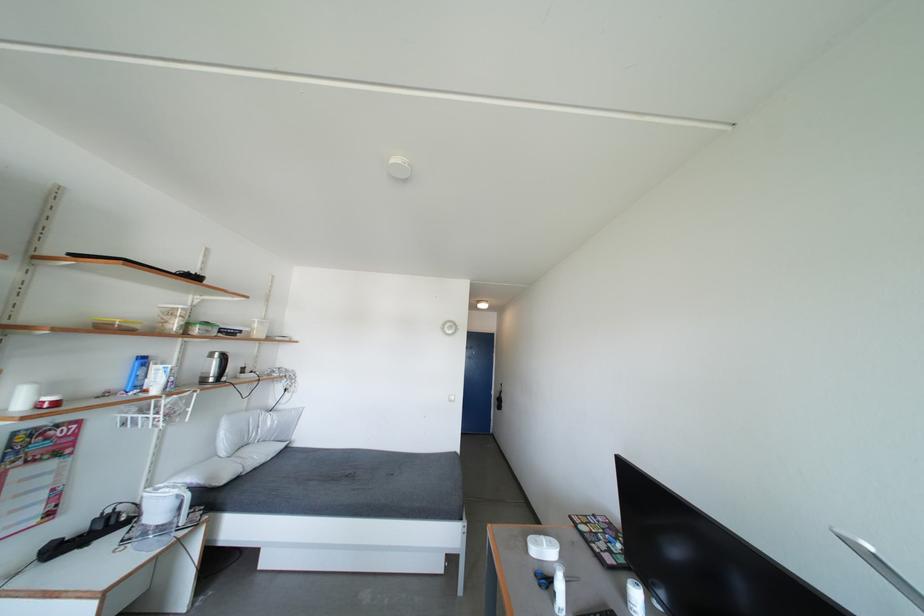
Find where to lift the black stickered case. Please return your answer as a coordinate pair (x, y).

(601, 539)